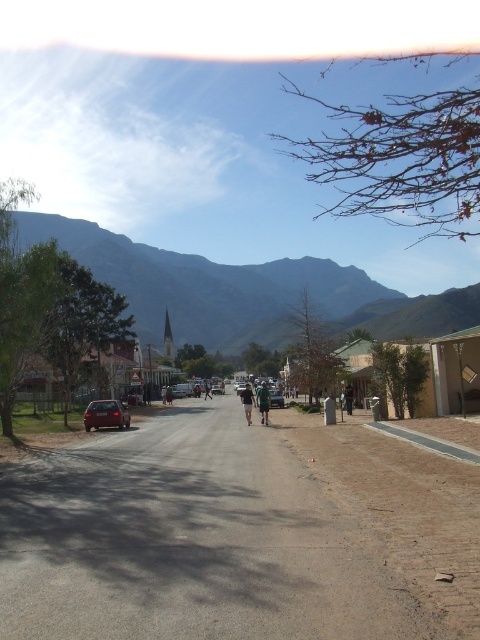
You are a photographer standing in the middle of the street. You want to take a photo that includes both the gray rocky mountain at upper center and the dark gray fabric pants at center. Which object will appear closer to the camera in the photo?

The gray rocky mountain at upper center will appear closer to the camera because it is positioned in front of the dark gray fabric pants at center.

You are a delivery person standing at the edge of the road. You need to place a package on the ground near the dark green fabric jacket at center without getting too close to the matte red car at left. Is this possible?

The matte red car at left is positioned under the dark green fabric jacket at center, meaning the car is directly beneath the jacket. Since the car is already occupying the space directly below the jacket, placing the package near the jacket without getting too close to the car might be challenging. However, if there is enough space between the car and the jacket, it could be possible. But based on the description, the car is directly under the jacket, so placing the package near the jacket would likely be